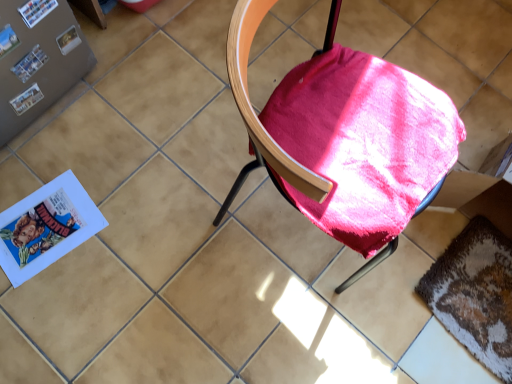
Question: Is textured brown mat at lower right outside velvet-like pink cushion at center?

Choices:
 (A) yes
 (B) no

Answer: (A)

Question: From a real-world perspective, is textured brown mat at lower right beneath velvet-like pink cushion at center?

Choices:
 (A) no
 (B) yes

Answer: (B)

Question: Is textured brown mat at lower right aimed at velvet-like pink cushion at center?

Choices:
 (A) no
 (B) yes

Answer: (B)

Question: From the image's perspective, is textured brown mat at lower right on velvet-like pink cushion at center?

Choices:
 (A) no
 (B) yes

Answer: (A)

Question: Can you confirm if textured brown mat at lower right is taller than velvet-like pink cushion at center?

Choices:
 (A) no
 (B) yes

Answer: (A)

Question: From a real-world perspective, is textured brown mat at lower right physically above velvet-like pink cushion at center?

Choices:
 (A) no
 (B) yes

Answer: (A)

Question: Does textured brown mat at lower right have a smaller size compared to matte paper paperback book at upper left, which is the 1th paperback book in top-to-bottom order?

Choices:
 (A) no
 (B) yes

Answer: (A)

Question: From the image's perspective, is textured brown mat at lower right over matte paper paperback book at upper left, which is the 2th paperback book from bottom to top?

Choices:
 (A) no
 (B) yes

Answer: (A)

Question: Is textured brown mat at lower right further to camera compared to matte paper paperback book at upper left, arranged as the 2th paperback book when viewed from the back?

Choices:
 (A) yes
 (B) no

Answer: (A)

Question: From a real-world perspective, is textured brown mat at lower right under matte paper paperback book at upper left, arranged as the 2th paperback book when viewed from the back?

Choices:
 (A) no
 (B) yes

Answer: (B)

Question: Does textured brown mat at lower right contain matte paper paperback book at upper left, which is the 2th paperback book from bottom to top?

Choices:
 (A) no
 (B) yes

Answer: (A)

Question: Can you confirm if textured brown mat at lower right is bigger than matte paper paperback book at upper left, acting as the 1th paperback book starting from the front?

Choices:
 (A) yes
 (B) no

Answer: (A)

Question: Is matte paper paperback book at upper left, which is the 2th paperback book from bottom to top, aimed at velvet-like pink cushion at center?

Choices:
 (A) yes
 (B) no

Answer: (A)